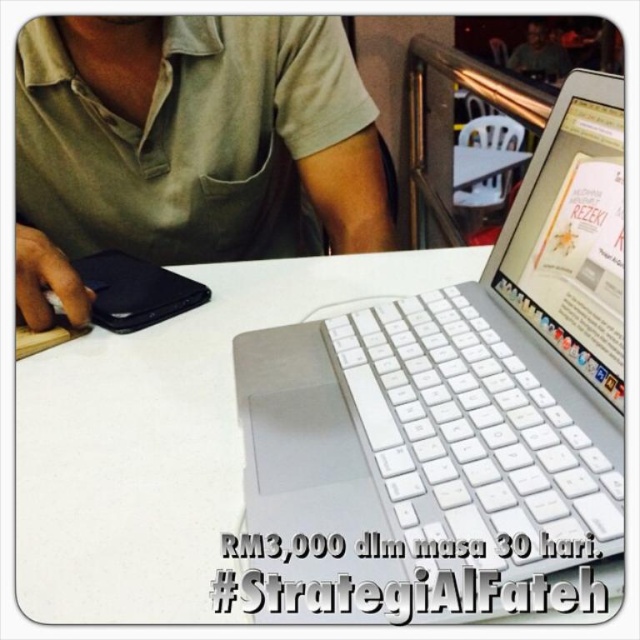
Between point (410, 336) and point (304, 298), which one is positioned behind?

Positioned behind is point (304, 298).

Can you confirm if white plastic keyboard at center is positioned above white matte table at center?

Incorrect, white plastic keyboard at center is not positioned above white matte table at center.

What do you see at coordinates (480, 435) in the screenshot? I see `white plastic keyboard at center` at bounding box center [480, 435].

You are a GUI agent. You are given a task and a screenshot of the screen. Output one action in this format:
    pyautogui.click(x=<x>, y=<y>)
    Task: Click on the white plastic keyboard at center
    The width and height of the screenshot is (640, 640).
    Given the screenshot: What is the action you would take?
    pyautogui.click(x=480, y=435)

Is white plastic laptop at center shorter than matte black laptop at upper center?

No.

Between white plastic laptop at center and matte black laptop at upper center, which one appears on the right side from the viewer's perspective?

matte black laptop at upper center

Identify the location of white plastic laptop at center. 452,412.

Is green fabric shirt at upper left taller than white matte table at center?

Indeed, green fabric shirt at upper left has a greater height compared to white matte table at center.

Who is lower down, green fabric shirt at upper left or white matte table at center?

white matte table at center is below.

Measure the distance between point [284,77] and camera.

Point [284,77] and camera are 28.58 inches apart from each other.

Identify the location of green fabric shirt at upper left. This screenshot has width=640, height=640. (188, 145).